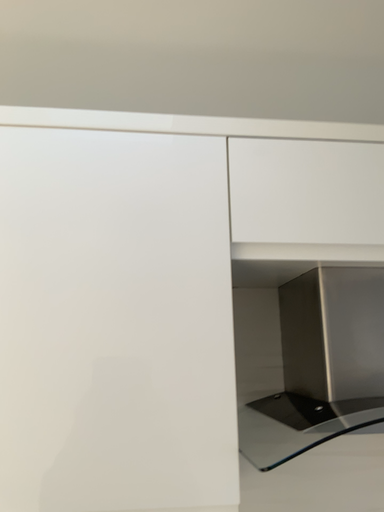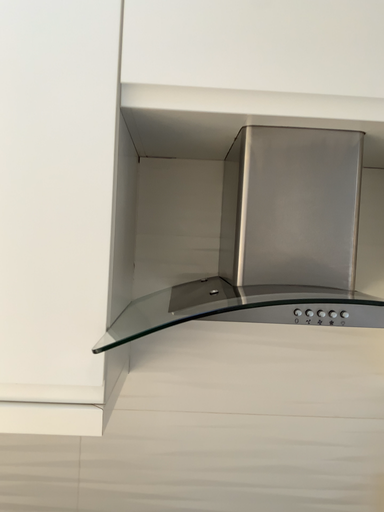
Question: How did the camera likely rotate when shooting the video?

Choices:
 (A) rotated downward
 (B) rotated upward

Answer: (A)